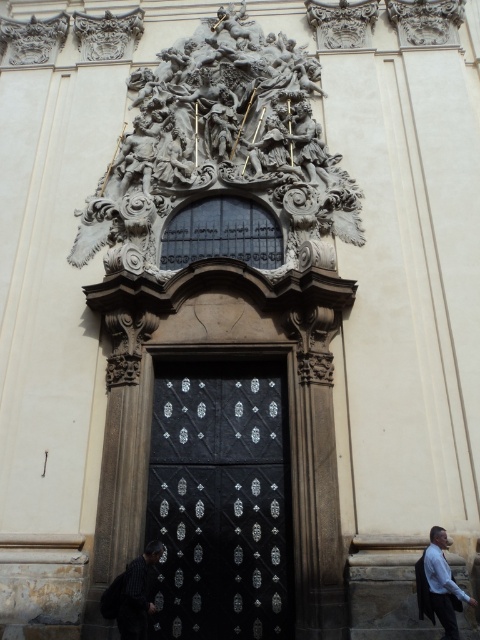
Question: Estimate the real-world distances between objects in this image. Which object is closer to the striped shirt at lower left?

Choices:
 (A) polished stone sculpture at upper center
 (B) black textured metal door at center

Answer: (B)

Question: Is polished stone sculpture at upper center to the left of striped shirt at lower left from the viewer's perspective?

Choices:
 (A) yes
 (B) no

Answer: (B)

Question: Is polished stone sculpture at upper center closer to camera compared to black textured metal door at center?

Choices:
 (A) yes
 (B) no

Answer: (B)

Question: Can you confirm if polished stone sculpture at upper center is positioned above black textured metal door at center?

Choices:
 (A) no
 (B) yes

Answer: (B)

Question: Among these objects, which one is farthest from the camera?

Choices:
 (A) striped shirt at lower left
 (B) light blue shirt at lower right
 (C) black textured metal door at center
 (D) polished stone sculpture at upper center

Answer: (D)

Question: Among these points, which one is farthest from the camera?

Choices:
 (A) (422, 580)
 (B) (231, 147)
 (C) (120, 620)
 (D) (273, 540)

Answer: (B)